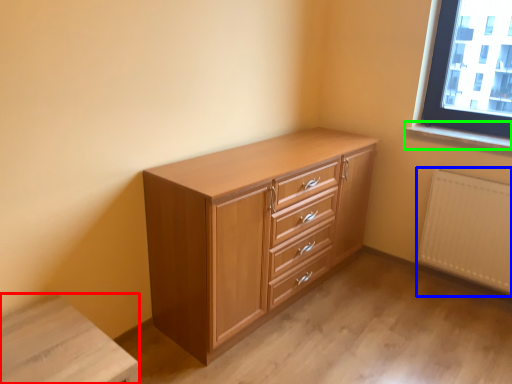
Question: Considering the real-world distances, which object is farthest from changing table (highlighted by a red box)? radiator (highlighted by a blue box) or window sill (highlighted by a green box)?

Choices:
 (A) radiator
 (B) window sill

Answer: (B)